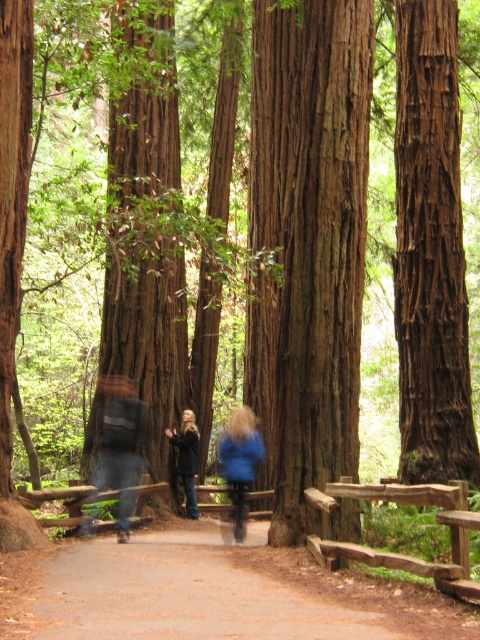
You are standing at the edge of the forest and see a point marked at coordinates (211, 593). According to the scene, where exactly is this point located?

The point is located on the brown dirt path at center.

You are standing on the forest pathway and want to take a photo of both point [276,524] and point [177,460]. Which point should you focus on first to ensure both are in focus?

You should focus on point [276,524] first because it is closer to the camera, ensuring the depth of field will cover both points.